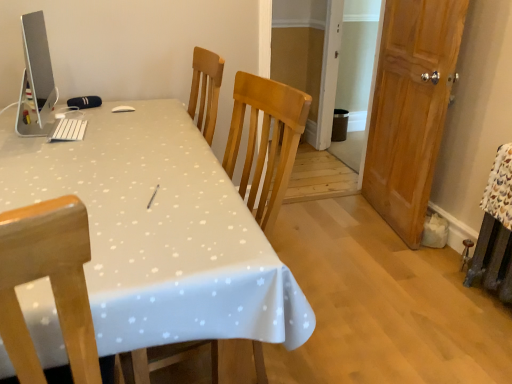
Question: Is sleek silver monitor at upper left in front of or behind wooden door at right in the image?

Choices:
 (A) front
 (B) behind

Answer: (A)

Question: Considering the relative positions of sleek silver monitor at upper left and wooden door at right in the image provided, is sleek silver monitor at upper left to the left or to the right of wooden door at right?

Choices:
 (A) left
 (B) right

Answer: (A)

Question: Which of these objects is positioned farthest from the wooden door at right?

Choices:
 (A) white glossy table at center
 (B) sleek silver monitor at upper left

Answer: (B)

Question: Which of these objects is positioned closest to the sleek silver monitor at upper left?

Choices:
 (A) white glossy table at center
 (B) wooden door at right

Answer: (A)